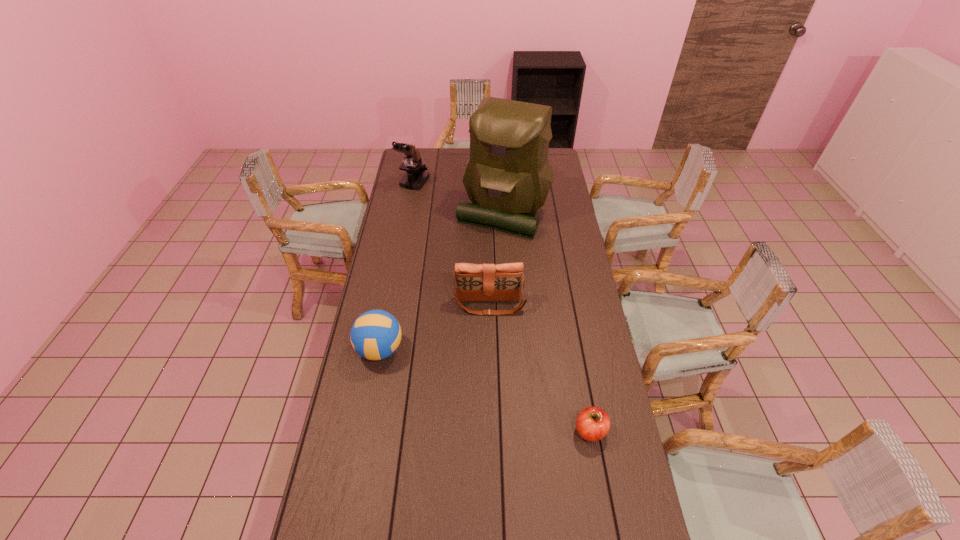
Image resolution: width=960 pixels, height=540 pixels. In order to click on unoccupied position between the shoulder bag and the microscope in this screenshot , I will do `click(452, 244)`.

Where is `empty space between the tallest object and the volleyball`? The height and width of the screenshot is (540, 960). empty space between the tallest object and the volleyball is located at coordinates (442, 280).

Locate an element on the screen. The width and height of the screenshot is (960, 540). free space between the second nearest object and the second tallest object is located at coordinates (397, 266).

Find the location of `free area in between the third farthest object and the backpack`. free area in between the third farthest object and the backpack is located at coordinates [496, 258].

The width and height of the screenshot is (960, 540). In order to click on vacant area between the apple and the second tallest object in this screenshot , I will do `click(502, 307)`.

The height and width of the screenshot is (540, 960). What are the coordinates of `vacant area that lies between the backpack and the third nearest object` in the screenshot? It's located at (496, 258).

Find the location of a particular element. The width and height of the screenshot is (960, 540). unoccupied position between the microscope and the third farthest object is located at coordinates point(452,244).

Locate an element on the screen. This screenshot has width=960, height=540. free space between the volleyball and the microscope is located at coordinates (397, 266).

Identify which object is the nearest to the second tallest object. Please provide its 2D coordinates. Your answer should be formatted as a tuple, i.e. [(x, y)], where the tuple contains the x and y coordinates of a point satisfying the conditions above.

[(508, 176)]

Image resolution: width=960 pixels, height=540 pixels. I want to click on the second closest object to the second nearest object, so click(x=508, y=176).